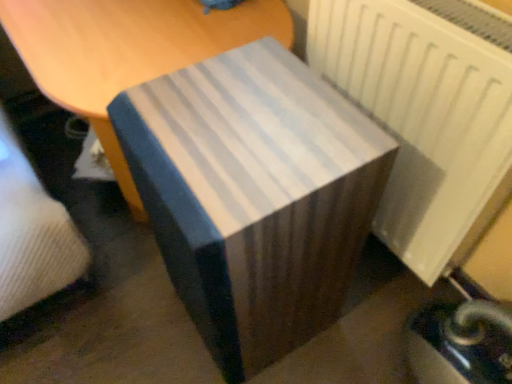
What do you see at coordinates (254, 196) in the screenshot? I see `blue striped fabric at center` at bounding box center [254, 196].

The width and height of the screenshot is (512, 384). Describe the element at coordinates (126, 51) in the screenshot. I see `white striped fabric at center` at that location.

The height and width of the screenshot is (384, 512). What are the coordinates of `white striped fabric at center` in the screenshot? It's located at (126, 51).

Identify the location of white matte radiator at right. The width and height of the screenshot is (512, 384). (422, 118).

Which of these two, blue striped fabric at center or white matte radiator at right, is bigger?

blue striped fabric at center is bigger.

Which object is closer to the camera taking this photo, blue striped fabric at center or white matte radiator at right?

blue striped fabric at center is in front.

Considering the relative sizes of blue striped fabric at center and white matte radiator at right in the image provided, is blue striped fabric at center shorter than white matte radiator at right?

Incorrect, the height of blue striped fabric at center does not fall short of that of white matte radiator at right.

Which is more to the left, blue striped fabric at center or white matte radiator at right?

From the viewer's perspective, blue striped fabric at center appears more on the left side.

Identify the location of table lying in front of the white matte radiator at right. (254, 196).

Which is nearer, [405,195] or [334,181]?

The point [334,181] is closer.

Which of these two, white matte radiator at right or blue striped fabric at center, is wider?

With larger width is blue striped fabric at center.

Does white striped fabric at center appear on the left side of blue striped fabric at center?

Yes.

Which is farther, (185, 23) or (132, 107)?

The point (185, 23) is behind.

Is white striped fabric at center in front of blue striped fabric at center?

That is False.

Is white striped fabric at center facing away from blue striped fabric at center?

No, white striped fabric at center's orientation is not away from blue striped fabric at center.

Can you tell me how much blue striped fabric at center and white striped fabric at center differ in facing direction?

The angular difference between blue striped fabric at center and white striped fabric at center is 3.01 degrees.

From a real-world perspective, is blue striped fabric at center physically below white striped fabric at center?

Incorrect, from a real-world perspective, blue striped fabric at center is higher than white striped fabric at center.

Is blue striped fabric at center taller or shorter than white striped fabric at center?

Clearly, blue striped fabric at center is taller compared to white striped fabric at center.

Can you see blue striped fabric at center touching white striped fabric at center?

blue striped fabric at center and white striped fabric at center are not in contact.

In order to click on furniture below the white matte radiator at right (from a real-world perspective) in this screenshot , I will do `click(126, 51)`.

Which is closer to the camera, (162, 60) or (481, 111)?

The point (481, 111) is in front.

In terms of size, does white striped fabric at center appear bigger or smaller than white matte radiator at right?

Clearly, white striped fabric at center is larger in size than white matte radiator at right.

Would you say white striped fabric at center is a long distance from white matte radiator at right?

No.

From a real-world perspective, does white matte radiator at right stand above white striped fabric at center?

Correct, in the physical world, white matte radiator at right is higher than white striped fabric at center.

Identify the location of furniture on the left of white matte radiator at right. point(126,51).

Is white matte radiator at right spatially inside white striped fabric at center, or outside of it?

white matte radiator at right is not enclosed by white striped fabric at center.

Image resolution: width=512 pixels, height=384 pixels. Find the location of `radiator that appears above the blue striped fabric at center (from the image's perspective)`. radiator that appears above the blue striped fabric at center (from the image's perspective) is located at coordinates (422, 118).

The image size is (512, 384). I want to click on table in front of the white matte radiator at right, so click(x=254, y=196).

From the image, which object appears to be farther from white matte radiator at right, blue striped fabric at center or white striped fabric at center?

white striped fabric at center is positioned further to the anchor white matte radiator at right.

Looking at the image, which one is located closer to blue striped fabric at center, white matte radiator at right or white striped fabric at center?

white matte radiator at right lies closer to blue striped fabric at center than the other object.

Estimate the real-world distances between objects in this image. Which object is closer to white striped fabric at center, blue striped fabric at center or white matte radiator at right?

The object closer to white striped fabric at center is blue striped fabric at center.

When comparing their distances from white matte radiator at right, does white striped fabric at center or blue striped fabric at center seem further?

white striped fabric at center is positioned further to the anchor white matte radiator at right.

Based on their spatial positions, is white matte radiator at right or blue striped fabric at center closer to white striped fabric at center?

Based on the image, blue striped fabric at center appears to be nearer to white striped fabric at center.

Considering their positions, is white striped fabric at center positioned closer to blue striped fabric at center than white matte radiator at right?

white matte radiator at right is positioned closer to the anchor blue striped fabric at center.

The height and width of the screenshot is (384, 512). Find the location of `table between white striped fabric at center and white matte radiator at right`. table between white striped fabric at center and white matte radiator at right is located at coordinates (254, 196).